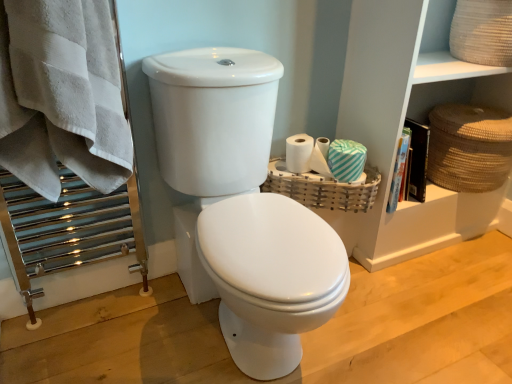
Question: Is teal striped toilet paper at right, the first toilet paper positioned from the right, a part of white glossy toilet at center?

Choices:
 (A) no
 (B) yes

Answer: (A)

Question: From the image's perspective, is white glossy toilet at center under teal striped toilet paper at right, which is counted as the second toilet paper, starting from the left?

Choices:
 (A) no
 (B) yes

Answer: (B)

Question: Considering the relative sizes of white glossy toilet at center and teal striped toilet paper at right, which is counted as the second toilet paper, starting from the left, in the image provided, is white glossy toilet at center taller than teal striped toilet paper at right, which is counted as the second toilet paper, starting from the left,?

Choices:
 (A) no
 (B) yes

Answer: (B)

Question: Considering the relative sizes of white glossy toilet at center and teal striped toilet paper at right, which is counted as the second toilet paper, starting from the left, in the image provided, is white glossy toilet at center bigger than teal striped toilet paper at right, which is counted as the second toilet paper, starting from the left,?

Choices:
 (A) yes
 (B) no

Answer: (A)

Question: From the image's perspective, is white glossy toilet at center on teal striped toilet paper at right, the first toilet paper positioned from the right?

Choices:
 (A) yes
 (B) no

Answer: (B)

Question: In the image, is teal striped toilet paper at right, the first toilet paper positioned from the right, on the left side or the right side of white glossy toilet at center?

Choices:
 (A) right
 (B) left

Answer: (A)

Question: Choose the correct answer: Is teal striped toilet paper at right, which is counted as the second toilet paper, starting from the left, inside white glossy toilet at center or outside it?

Choices:
 (A) outside
 (B) inside

Answer: (A)

Question: In terms of height, does teal striped toilet paper at right, which is counted as the second toilet paper, starting from the left, look taller or shorter compared to white glossy toilet at center?

Choices:
 (A) short
 (B) tall

Answer: (A)

Question: Looking at the image, does teal striped toilet paper at right, which is counted as the second toilet paper, starting from the left, seem bigger or smaller compared to white glossy toilet at center?

Choices:
 (A) big
 (B) small

Answer: (B)

Question: Is point (434, 81) closer or farther from the camera than point (214, 170)?

Choices:
 (A) farther
 (B) closer

Answer: (A)

Question: In the image, is woven beige basket at upper right, which appears as the 2th shelf when ordered from the bottom, on the left side or the right side of white glossy toilet at center?

Choices:
 (A) left
 (B) right

Answer: (B)

Question: From the image's perspective, is woven beige basket at upper right, the first shelf when ordered from top to bottom, located above or below white glossy toilet at center?

Choices:
 (A) above
 (B) below

Answer: (A)

Question: Looking at the image, does woven beige basket at upper right, which appears as the 2th shelf when ordered from the bottom, seem bigger or smaller compared to white glossy toilet at center?

Choices:
 (A) big
 (B) small

Answer: (B)

Question: Considering the positions of white glossy toilet at center and brown woven basket at right, the 1th basket viewed from the right, in the image, is white glossy toilet at center bigger or smaller than brown woven basket at right, the 1th basket viewed from the right,?

Choices:
 (A) big
 (B) small

Answer: (A)

Question: Would you say white glossy toilet at center is to the left or to the right of brown woven basket at right, the 1th basket viewed from the right, in the picture?

Choices:
 (A) right
 (B) left

Answer: (B)